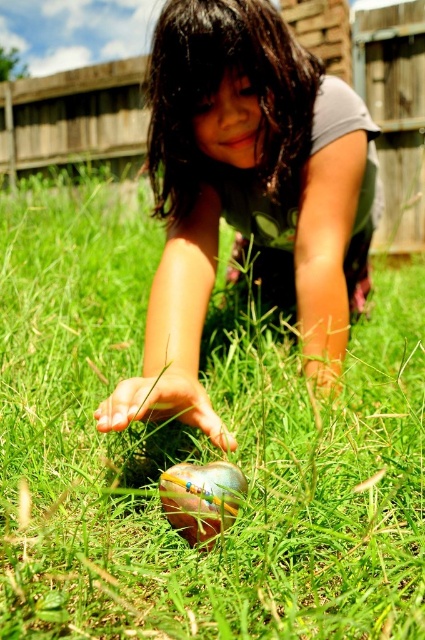
Does matte green dress at center have a greater height compared to shiny metallic ball at center?

Yes, matte green dress at center is taller than shiny metallic ball at center.

This screenshot has height=640, width=425. I want to click on matte green dress at center, so click(246, 193).

At what (x,y) coordinates should I click in order to perform the action: click on matte green dress at center. Please return your answer as a coordinate pair (x, y). Looking at the image, I should click on (246, 193).